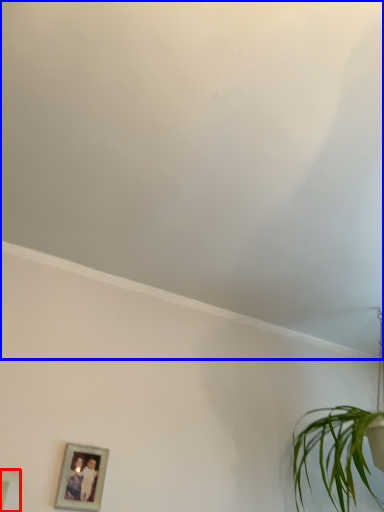
Question: Which point is closer to the camera, picture frame (highlighted by a red box) or cloud (highlighted by a blue box)?

Choices:
 (A) picture frame
 (B) cloud

Answer: (B)